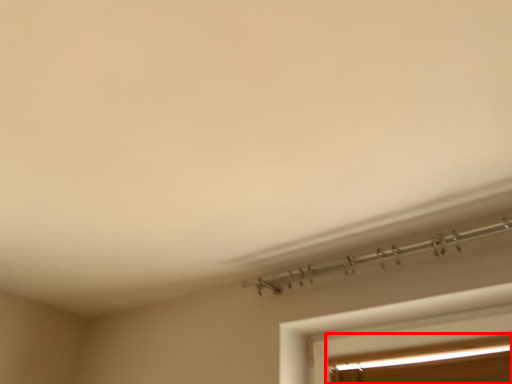
Question: Considering the relative positions of window (annotated by the red box) and window in the image provided, where is window (annotated by the red box) located with respect to the staircase?

Choices:
 (A) right
 (B) left

Answer: (A)